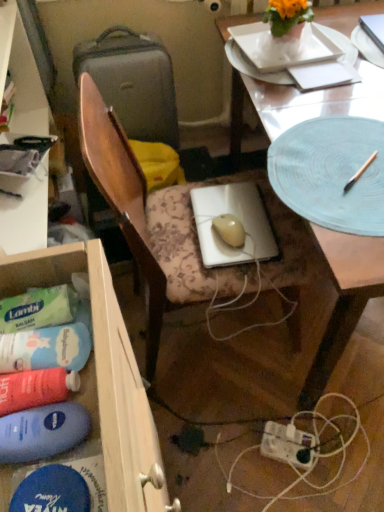
Question: Can we say white plastic power plugs and sockets at lower center lies outside blue matte paper plate at upper right?

Choices:
 (A) yes
 (B) no

Answer: (A)

Question: Does white plastic power plugs and sockets at lower center lie in front of blue matte paper plate at upper right?

Choices:
 (A) no
 (B) yes

Answer: (A)

Question: From a real-world perspective, is white plastic power plugs and sockets at lower center positioned over blue matte paper plate at upper right based on gravity?

Choices:
 (A) yes
 (B) no

Answer: (B)

Question: Does white plastic power plugs and sockets at lower center contain blue matte paper plate at upper right?

Choices:
 (A) no
 (B) yes

Answer: (A)

Question: From the image's perspective, would you say white plastic power plugs and sockets at lower center is shown under blue matte paper plate at upper right?

Choices:
 (A) yes
 (B) no

Answer: (A)

Question: Is wooden drawer at lower left to the left or to the right of wooden chair at center in the image?

Choices:
 (A) left
 (B) right

Answer: (A)

Question: Is wooden drawer at lower left taller or shorter than wooden chair at center?

Choices:
 (A) tall
 (B) short

Answer: (A)

Question: Considering the positions of wooden drawer at lower left and wooden chair at center in the image, is wooden drawer at lower left wider or thinner than wooden chair at center?

Choices:
 (A) wide
 (B) thin

Answer: (B)

Question: From a real-world perspective, is wooden drawer at lower left physically located above or below wooden chair at center?

Choices:
 (A) above
 (B) below

Answer: (A)

Question: In terms of height, does matte gray suitcase at left look taller or shorter compared to translucent glass desk at center?

Choices:
 (A) short
 (B) tall

Answer: (A)

Question: Looking at the image, does matte gray suitcase at left seem bigger or smaller compared to translucent glass desk at center?

Choices:
 (A) big
 (B) small

Answer: (B)

Question: Is matte gray suitcase at left spatially inside translucent glass desk at center, or outside of it?

Choices:
 (A) outside
 (B) inside

Answer: (A)

Question: In the image, is matte gray suitcase at left positioned in front of or behind translucent glass desk at center?

Choices:
 (A) front
 (B) behind

Answer: (B)

Question: Is translucent glass desk at center to the left or to the right of white paper at upper right in the image?

Choices:
 (A) right
 (B) left

Answer: (A)

Question: From the image's perspective, is translucent glass desk at center positioned above or below white paper at upper right?

Choices:
 (A) below
 (B) above

Answer: (A)